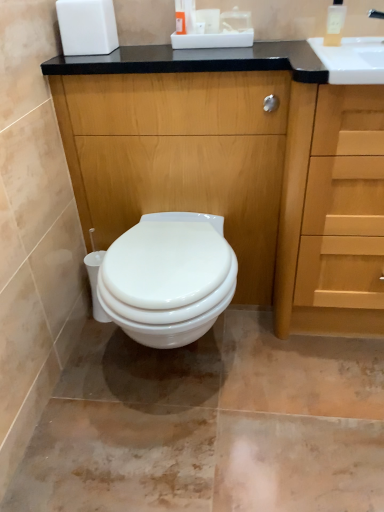
Locate an element on the screen. This screenshot has width=384, height=512. white matte toilet paper at upper center is located at coordinates (209, 19).

What do you see at coordinates (209, 19) in the screenshot? I see `white matte toilet paper at upper center` at bounding box center [209, 19].

What do you see at coordinates (344, 202) in the screenshot?
I see `light wood drawer at right` at bounding box center [344, 202].

Identify the location of light wood drawer at right. (344, 202).

Image resolution: width=384 pixels, height=512 pixels. Identify the location of wooden cabinet at center. (238, 167).

Is light wood drawer at right positioned far away from white matte toilet paper at upper center?

light wood drawer at right is actually quite close to white matte toilet paper at upper center.

Based on the photo, considering the relative positions of light wood drawer at right and white matte toilet paper at upper center in the image provided, is light wood drawer at right to the right of white matte toilet paper at upper center from the viewer's perspective?

Indeed, light wood drawer at right is positioned on the right side of white matte toilet paper at upper center.

Can we say light wood drawer at right lies outside white matte toilet paper at upper center?

light wood drawer at right is positioned outside white matte toilet paper at upper center.

Which of these two, white matte toilet paper at upper center or wooden cabinet at center, is thinner?

Thinner between the two is white matte toilet paper at upper center.

How many degrees apart are the facing directions of white matte toilet paper at upper center and wooden cabinet at center?

The facing directions of white matte toilet paper at upper center and wooden cabinet at center are 0.526 degrees apart.

Is white matte toilet paper at upper center bigger than wooden cabinet at center?

No.

Looking at this image, is wooden cabinet at center at the back of white matte toilet paper at upper center?

No, white matte toilet paper at upper center is not facing the opposite direction of wooden cabinet at center.

How different are the orientations of translucent plastic soap dispenser at upper right and wooden cabinet at center in degrees?

The facing directions of translucent plastic soap dispenser at upper right and wooden cabinet at center are 8.05 degrees apart.

Is translucent plastic soap dispenser at upper right completely or partially outside of wooden cabinet at center?

That's correct, translucent plastic soap dispenser at upper right is outside of wooden cabinet at center.

From the image's perspective, between translucent plastic soap dispenser at upper right and wooden cabinet at center, which one is located above?

translucent plastic soap dispenser at upper right.

Would you say translucent plastic soap dispenser at upper right is to the left or to the right of wooden cabinet at center in the picture?

Based on their positions, translucent plastic soap dispenser at upper right is located to the right of wooden cabinet at center.

Does white matte toilet paper at upper center have a smaller size compared to translucent plastic soap dispenser at upper right?

Correct, white matte toilet paper at upper center occupies less space than translucent plastic soap dispenser at upper right.

From the image's perspective, which object appears higher, white matte toilet paper at upper center or translucent plastic soap dispenser at upper right?

white matte toilet paper at upper center, from the image's perspective.

From a real-world perspective, is white matte toilet paper at upper center located beneath translucent plastic soap dispenser at upper right?

Yes.

Based on their sizes in the image, would you say translucent plastic soap dispenser at upper right is bigger or smaller than white matte toilet paper at upper center?

In the image, translucent plastic soap dispenser at upper right appears to be larger than white matte toilet paper at upper center.

How much distance is there between translucent plastic soap dispenser at upper right and white matte toilet paper at upper center?

translucent plastic soap dispenser at upper right is 14.14 inches from white matte toilet paper at upper center.

The width and height of the screenshot is (384, 512). In the image, there is a white matte toilet paper at upper center. In order to click on soap dispenser below it (from the image's perspective) in this screenshot , I will do `click(335, 23)`.

Is translucent plastic soap dispenser at upper right not near white matte toilet paper at upper center?

No, translucent plastic soap dispenser at upper right is not far from white matte toilet paper at upper center.

Is white matte toilet paper at upper center positioned in front of light wood drawer at right?

No, the depth of white matte toilet paper at upper center is greater than that of light wood drawer at right.

From a real-world perspective, is white matte toilet paper at upper center physically above light wood drawer at right?

Yes.

In the scene shown: From the image's perspective, which one is positioned lower, white matte toilet paper at upper center or light wood drawer at right?

light wood drawer at right.

Which is closer, [214,20] or [318,172]?

Point [214,20] is farther from the camera than point [318,172].

Who is shorter, light wood drawer at right or wooden cabinet at center?

With less height is light wood drawer at right.

Is wooden cabinet at center surrounded by light wood drawer at right?

No, wooden cabinet at center is located outside of light wood drawer at right.

Is light wood drawer at right in contact with wooden cabinet at center?

They are not placed beside each other.

Based on their sizes in the image, would you say light wood drawer at right is bigger or smaller than wooden cabinet at center?

Considering their sizes, light wood drawer at right takes up more space than wooden cabinet at center.

Find the location of a particular element. The image size is (384, 512). drawer that is in front of the white matte toilet paper at upper center is located at coordinates (344, 202).

Locate an element on the screen. The width and height of the screenshot is (384, 512). toilet paper that is above the wooden cabinet at center (from the image's perspective) is located at coordinates (209, 19).

When comparing their distances from white matte toilet paper at upper center, does wooden cabinet at center or light wood drawer at right seem closer?

wooden cabinet at center lies closer to white matte toilet paper at upper center than the other object.

Considering their positions, is white matte toilet paper at upper center positioned closer to light wood drawer at right than wooden cabinet at center?

Based on the image, wooden cabinet at center appears to be nearer to light wood drawer at right.

Considering their positions, is light wood drawer at right positioned further to wooden cabinet at center than translucent plastic soap dispenser at upper right?

translucent plastic soap dispenser at upper right is positioned further to the anchor wooden cabinet at center.

Estimate the real-world distances between objects in this image. Which object is closer to wooden cabinet at center, white matte toilet paper at upper center or translucent plastic soap dispenser at upper right?

Among the two, white matte toilet paper at upper center is located nearer to wooden cabinet at center.

When comparing their distances from translucent plastic soap dispenser at upper right, does wooden cabinet at center or light wood drawer at right seem closer?

light wood drawer at right is positioned closer to the anchor translucent plastic soap dispenser at upper right.

When comparing their distances from translucent plastic soap dispenser at upper right, does white matte toilet paper at upper center or wooden cabinet at center seem closer?

white matte toilet paper at upper center is positioned closer to the anchor translucent plastic soap dispenser at upper right.

Considering their positions, is white matte toilet paper at upper center positioned closer to wooden cabinet at center than light wood drawer at right?

Based on the image, light wood drawer at right appears to be nearer to wooden cabinet at center.

Based on their spatial positions, is translucent plastic soap dispenser at upper right or wooden cabinet at center further from light wood drawer at right?

Among the two, translucent plastic soap dispenser at upper right is located further to light wood drawer at right.

The width and height of the screenshot is (384, 512). I want to click on toilet paper situated between wooden cabinet at center and light wood drawer at right from left to right, so click(209, 19).

You are a GUI agent. You are given a task and a screenshot of the screen. Output one action in this format:
    pyautogui.click(x=<x>, y=<y>)
    Task: Click on the soap dispenser situated between wooden cabinet at center and light wood drawer at right from left to right
    The image size is (384, 512).
    Given the screenshot: What is the action you would take?
    pyautogui.click(x=335, y=23)

Image resolution: width=384 pixels, height=512 pixels. I want to click on soap dispenser between white matte toilet paper at upper center and light wood drawer at right in the up-down direction, so click(335, 23).

Locate an element on the screen. The image size is (384, 512). soap dispenser between white matte toilet paper at upper center and wooden cabinet at center from top to bottom is located at coordinates (335, 23).